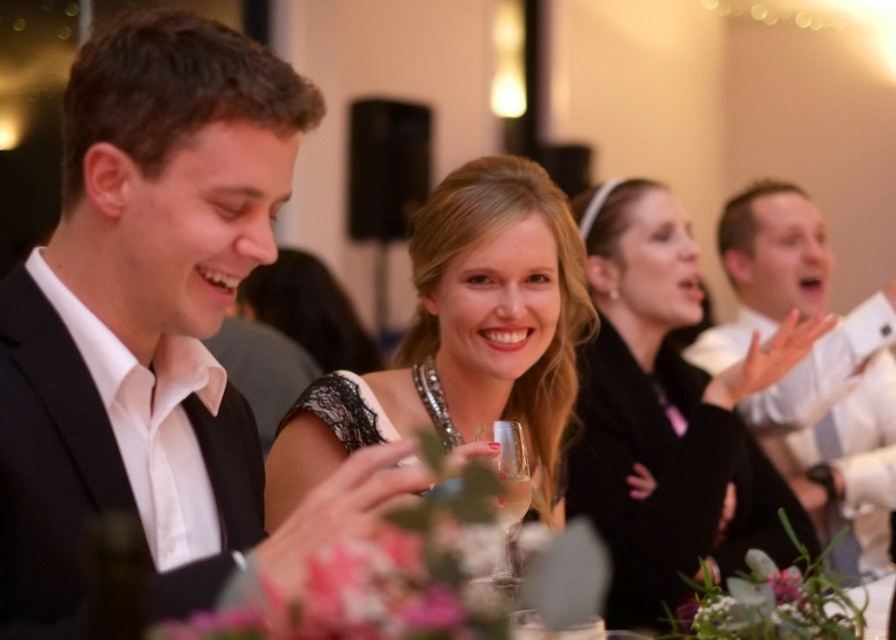
You are a photographer at the event and want to capture a photo of both the black satin suit at left and the matte black dress at center. Since you can only focus on one subject at a time, which one should you focus on first to ensure both are in the frame?

You should focus on the black satin suit at left first because it is positioned to the left of the matte black dress at center, so by starting with the leftmost subject, you can ensure both are included in the frame.

From the picture: You are standing at the entrance of the event and want to find the black satin suit at left. According to the coordinates provided, where should you look relative to the center of the image?

The black satin suit at left is located at point 0.517 along the x axis and 0.174 along the y axis relative to the center of the image.

You are standing at the entrance of the event and want to find the black satin suit at left. According to the coordinates provided, in which direction should you look relative to the center of the image?

The black satin suit at left is located at coordinates point (154, 330), which means it is positioned to the right and slightly below the center of the image. Therefore, you should look to the right and downward from the center to find it.